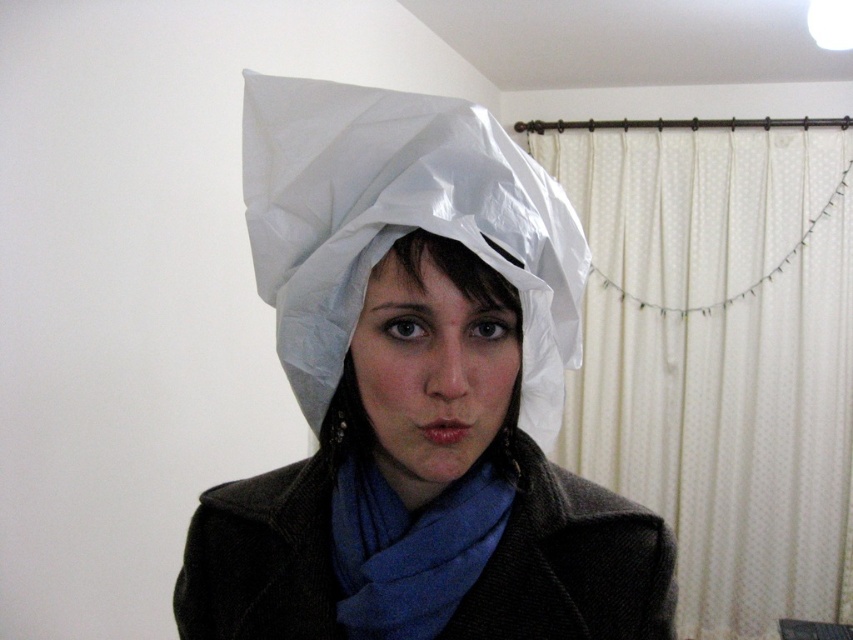
You are designing a display for a craft fair and need to place two different types of white paper hats on a shelf. The shelf is only 2 inches wide. Can both the white glossy paper hat at center and the matte white paper hat at center fit side by side on the shelf without overlapping?

The white glossy paper hat at center and matte white paper hat at center are 2.17 inches apart from each other, so they cannot fit side by side on a 2 inch wide shelf without overlapping.

You are trying to decide whether to wear the matte white paper hat at center and the blue soft scarf at center together. Based on their sizes, will the hat cover the scarf when worn?

The matte white paper hat at center is larger in size than the blue soft scarf at center, so when worn, the hat will likely cover the scarf since it is bigger.